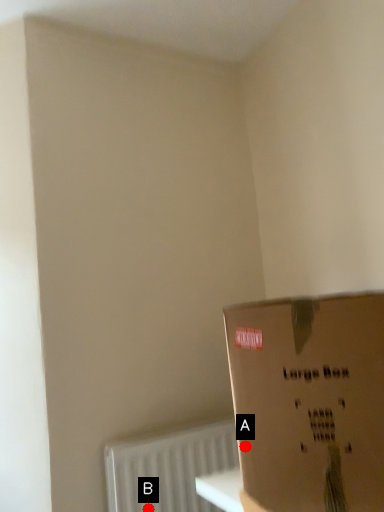
Question: Two points are circled on the image, labeled by A and B beside each circle. Which point appears farthest from the camera in this image?

Choices:
 (A) A is further
 (B) B is further

Answer: (B)